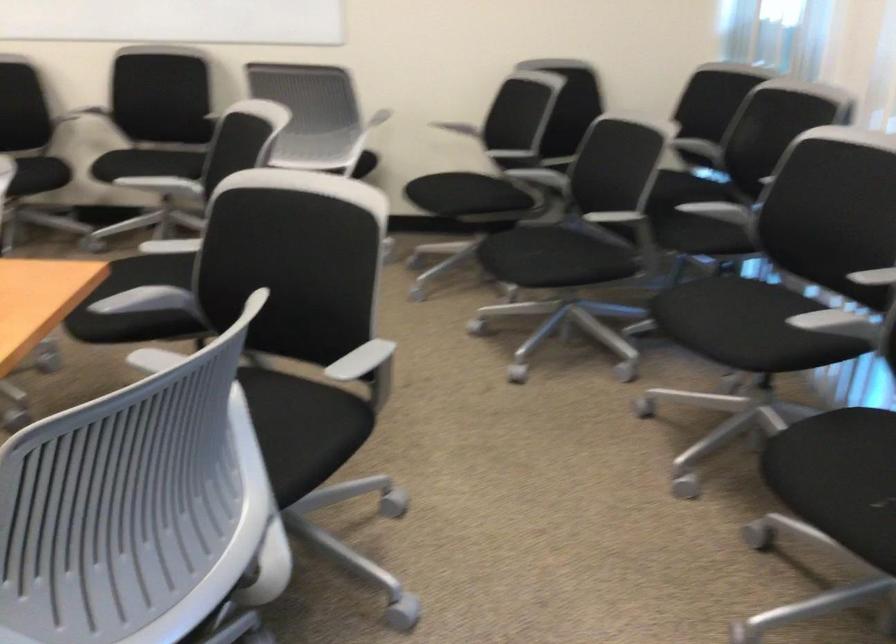
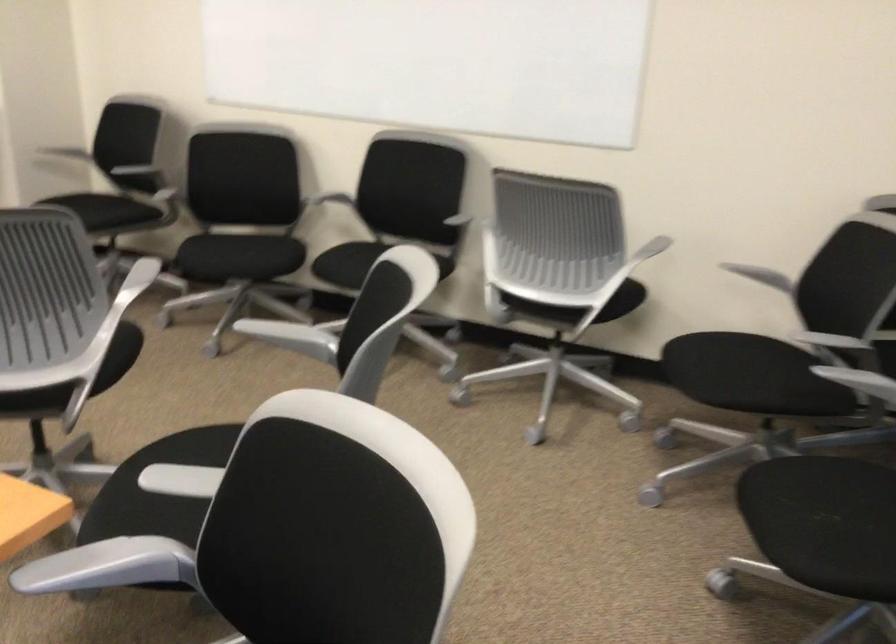
Question: In a continuous first-person perspective shot, in which direction is the camera moving?

Choices:
 (A) Left
 (B) Right
 (C) Forward
 (D) Backward

Answer: (C)